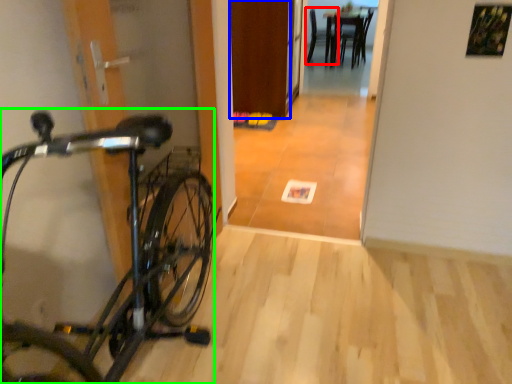
Question: Estimate the real-world distances between objects in this image. Which object is closer to chair (highlighted by a red box), door (highlighted by a blue box) or bicycle (highlighted by a green box)?

Choices:
 (A) door
 (B) bicycle

Answer: (A)